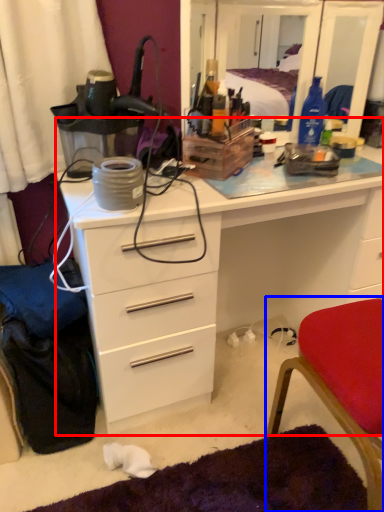
Question: Which object is further to the camera taking this photo, chest of drawers (highlighted by a red box) or chair (highlighted by a blue box)?

Choices:
 (A) chest of drawers
 (B) chair

Answer: (A)